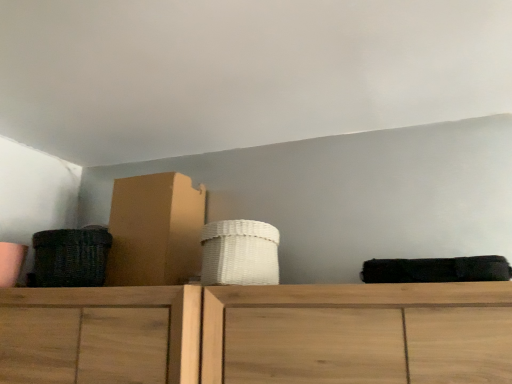
How much space does dark brown woven basket at left, placed as the second basket when sorted from right to left, occupy vertically?

7.25 inches.

Where is `dark brown woven basket at left, which is counted as the 1th basket, starting from the left`? dark brown woven basket at left, which is counted as the 1th basket, starting from the left is located at coordinates (70, 257).

Identify the location of white woven basket at center, which is counted as the 2th basket, starting from the left. (240, 253).

Consider the image. In order to face white woven basket at center, which is counted as the 2th basket, starting from the left, should I rotate leftwards or rightwards?

Rotate left and turn 3.090 degrees.

The image size is (512, 384). I want to click on dark brown woven basket at left, which is counted as the 1th basket, starting from the left, so tap(70, 257).

From the image's perspective, is white woven basket at center, positioned as the first basket in right-to-left order, located above or below dark brown woven basket at left, which is counted as the 1th basket, starting from the left?

Clearly, from the image's perspective, white woven basket at center, positioned as the first basket in right-to-left order, is above dark brown woven basket at left, which is counted as the 1th basket, starting from the left.

Is white woven basket at center, positioned as the first basket in right-to-left order, to the right of dark brown woven basket at left, placed as the second basket when sorted from right to left, from the viewer's perspective?

Yes, white woven basket at center, positioned as the first basket in right-to-left order, is to the right of dark brown woven basket at left, placed as the second basket when sorted from right to left.

Between white woven basket at center, positioned as the first basket in right-to-left order, and dark brown woven basket at left, placed as the second basket when sorted from right to left, which one is positioned behind?

dark brown woven basket at left, placed as the second basket when sorted from right to left.

Is white woven basket at center, positioned as the first basket in right-to-left order, not inside dark brown woven basket at left, which is counted as the 1th basket, starting from the left?

Yes.

Looking at the image, does white woven basket at center, positioned as the first basket in right-to-left order, seem bigger or smaller compared to cardboard box at left?

Clearly, white woven basket at center, positioned as the first basket in right-to-left order, is smaller in size than cardboard box at left.

Can you confirm if white woven basket at center, which is counted as the 2th basket, starting from the left, is taller than cardboard box at left?

No.

From the image's perspective, is white woven basket at center, which is counted as the 2th basket, starting from the left, located above or below cardboard box at left?

white woven basket at center, which is counted as the 2th basket, starting from the left, is situated lower than cardboard box at left in the image.

Does point (211, 251) come farther from viewer compared to point (119, 226)?

That is False.

Is dark brown woven basket at left, which is counted as the 1th basket, starting from the left, at the back of cardboard box at left?

No, cardboard box at left is not facing the opposite direction of dark brown woven basket at left, which is counted as the 1th basket, starting from the left.

Which is nearer, (123,258) or (72,273)?

Point (123,258) is positioned farther from the camera compared to point (72,273).

Is cardboard box at left closer to the viewer compared to dark brown woven basket at left, placed as the second basket when sorted from right to left?

No, cardboard box at left is further to the viewer.

Can you confirm if cardboard box at left is thinner than dark brown woven basket at left, placed as the second basket when sorted from right to left?

No, cardboard box at left is not thinner than dark brown woven basket at left, placed as the second basket when sorted from right to left.

Does dark brown woven basket at left, placed as the second basket when sorted from right to left, have a greater width compared to white woven basket at center, positioned as the first basket in right-to-left order?

Incorrect, the width of dark brown woven basket at left, placed as the second basket when sorted from right to left, does not surpass that of white woven basket at center, positioned as the first basket in right-to-left order.

Find the location of a particular element. basket on the right of the dark brown woven basket at left, which is counted as the 1th basket, starting from the left is located at coordinates (240, 253).

In the scene shown: Is dark brown woven basket at left, placed as the second basket when sorted from right to left, aimed at white woven basket at center, positioned as the first basket in right-to-left order?

No, dark brown woven basket at left, placed as the second basket when sorted from right to left, is not oriented towards white woven basket at center, positioned as the first basket in right-to-left order.

Considering their positions, is dark brown woven basket at left, placed as the second basket when sorted from right to left, located in front of or behind white woven basket at center, which is counted as the 2th basket, starting from the left?

Visually, dark brown woven basket at left, placed as the second basket when sorted from right to left, is located behind white woven basket at center, which is counted as the 2th basket, starting from the left.

Considering the relative positions of dark brown woven basket at left, which is counted as the 1th basket, starting from the left, and cardboard box at left in the image provided, is dark brown woven basket at left, which is counted as the 1th basket, starting from the left, behind cardboard box at left?

No, it is in front of cardboard box at left.

Consider the image. Considering the positions of objects dark brown woven basket at left, placed as the second basket when sorted from right to left, and cardboard box at left in the image provided, who is more to the left, dark brown woven basket at left, placed as the second basket when sorted from right to left, or cardboard box at left?

dark brown woven basket at left, placed as the second basket when sorted from right to left.

Does dark brown woven basket at left, which is counted as the 1th basket, starting from the left, contain cardboard box at left?

No, cardboard box at left is not a part of dark brown woven basket at left, which is counted as the 1th basket, starting from the left.

Which of these two, dark brown woven basket at left, which is counted as the 1th basket, starting from the left, or cardboard box at left, is wider?

With larger width is cardboard box at left.

Is point (169, 248) less distant than point (258, 280)?

No, it is behind (258, 280).

Between cardboard box at left and white woven basket at center, positioned as the first basket in right-to-left order, which one has smaller size?

Smaller between the two is white woven basket at center, positioned as the first basket in right-to-left order.

Considering the sizes of objects cardboard box at left and white woven basket at center, which is counted as the 2th basket, starting from the left, in the image provided, who is taller, cardboard box at left or white woven basket at center, which is counted as the 2th basket, starting from the left,?

cardboard box at left is taller.

Considering the positions of objects cardboard box at left and white woven basket at center, which is counted as the 2th basket, starting from the left, in the image provided, who is more to the right, cardboard box at left or white woven basket at center, which is counted as the 2th basket, starting from the left,?

From the viewer's perspective, white woven basket at center, which is counted as the 2th basket, starting from the left, appears more on the right side.

There is a dark brown woven basket at left, which is counted as the 1th basket, starting from the left. Identify the location of basket above it (from a real-world perspective). Image resolution: width=512 pixels, height=384 pixels. (240, 253).

Identify the location of basket that is the 2nd object located in front of the cardboard box at left. This screenshot has width=512, height=384. (240, 253).

Based on their spatial positions, is cardboard box at left or white woven basket at center, positioned as the first basket in right-to-left order, closer to dark brown woven basket at left, which is counted as the 1th basket, starting from the left?

The object closer to dark brown woven basket at left, which is counted as the 1th basket, starting from the left, is cardboard box at left.

Considering their positions, is dark brown woven basket at left, placed as the second basket when sorted from right to left, positioned closer to cardboard box at left than white woven basket at center, positioned as the first basket in right-to-left order?

dark brown woven basket at left, placed as the second basket when sorted from right to left.

From the image, which object appears to be nearer to white woven basket at center, which is counted as the 2th basket, starting from the left, dark brown woven basket at left, placed as the second basket when sorted from right to left, or cardboard box at left?

cardboard box at left is positioned closer to the anchor white woven basket at center, which is counted as the 2th basket, starting from the left.

Based on their spatial positions, is white woven basket at center, which is counted as the 2th basket, starting from the left, or dark brown woven basket at left, which is counted as the 1th basket, starting from the left, further from cardboard box at left?

white woven basket at center, which is counted as the 2th basket, starting from the left, lies further to cardboard box at left than the other object.

Based on their spatial positions, is white woven basket at center, positioned as the first basket in right-to-left order, or cardboard box at left closer to dark brown woven basket at left, placed as the second basket when sorted from right to left?

Based on the image, cardboard box at left appears to be nearer to dark brown woven basket at left, placed as the second basket when sorted from right to left.

Estimate the real-world distances between objects in this image. Which object is further from white woven basket at center, positioned as the first basket in right-to-left order, cardboard box at left or dark brown woven basket at left, placed as the second basket when sorted from right to left?

dark brown woven basket at left, placed as the second basket when sorted from right to left.

Identify the location of cardboard box between dark brown woven basket at left, placed as the second basket when sorted from right to left, and white woven basket at center, positioned as the first basket in right-to-left order, in the horizontal direction. Image resolution: width=512 pixels, height=384 pixels. point(155,230).